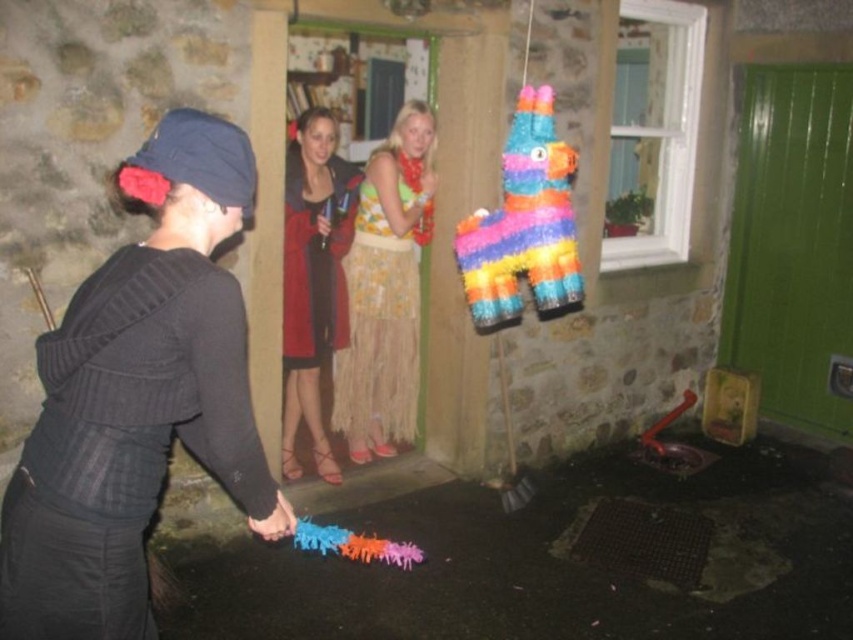
Based on the photo, you are standing at the point labeled as point (317, 380) and want to walk towards the entrance of the green door. However, there is an obstacle at point (309, 529) blocking your path. Can you walk around the obstacle to reach the door?

Since point (317, 380) is behind point (309, 529), you can walk around the obstacle by moving either to the left or right of point (309, 529) to reach the entrance of the green door.

You are organizing a party and need to place decorations. The rubber toy ants at lower center and the black knitted sweater at center are both on the table. Which decoration takes up more space horizontally?

The rubber toy ants at lower center take up more space horizontally because their width is larger than that of the black knitted sweater at center.

You are at a party and want to place a small decoration between the rubber toy ants at lower center and the black knitted sweater at center. Where should you place it to be centered between them?

The rubber toy ants at lower center is positioned on the right side of black knitted sweater at center, so placing the decoration to the left of the rubber toy ants at lower center and to the right of the black knitted sweater at center would center it between them.